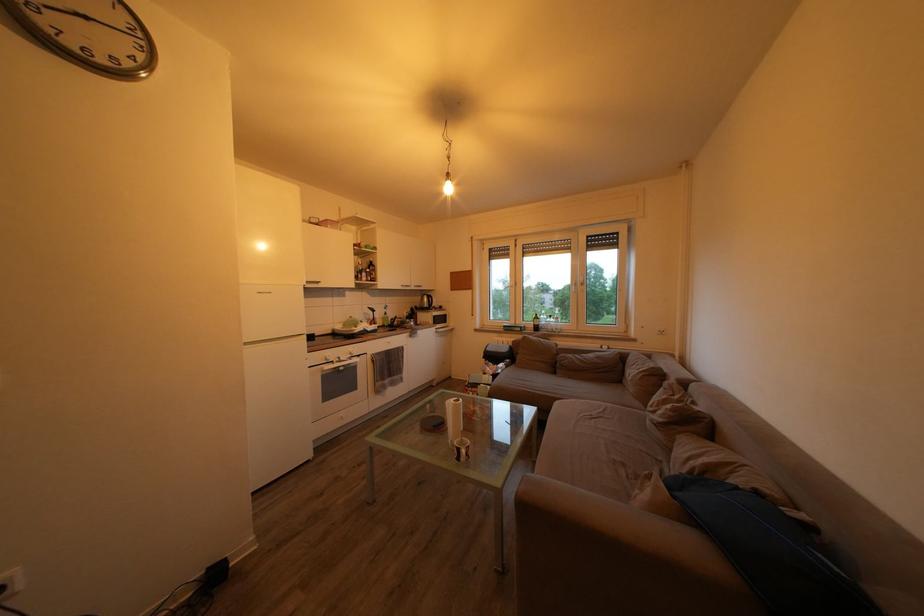
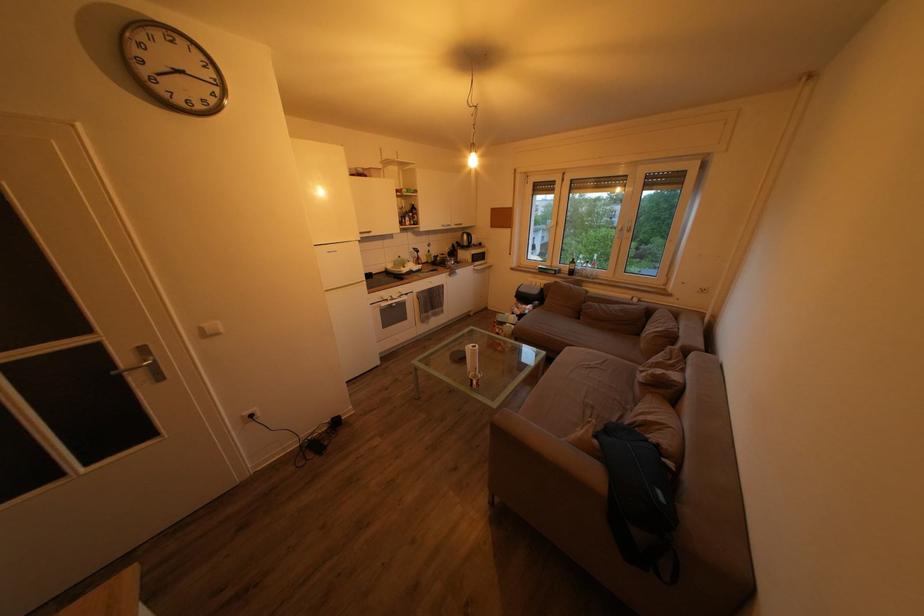
The point at (x=444, y=431) is marked in the first image. Where is the corresponding point in the second image?

(468, 365)